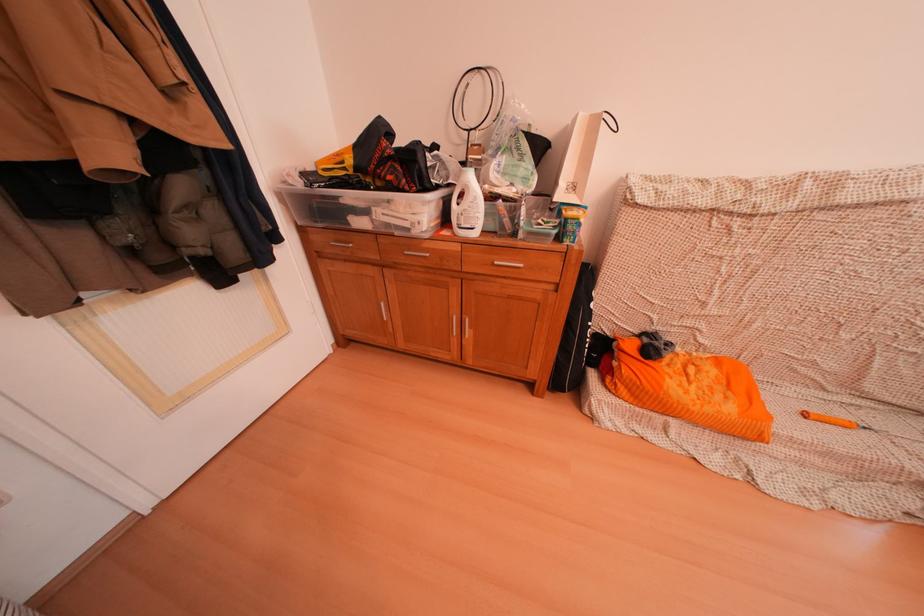
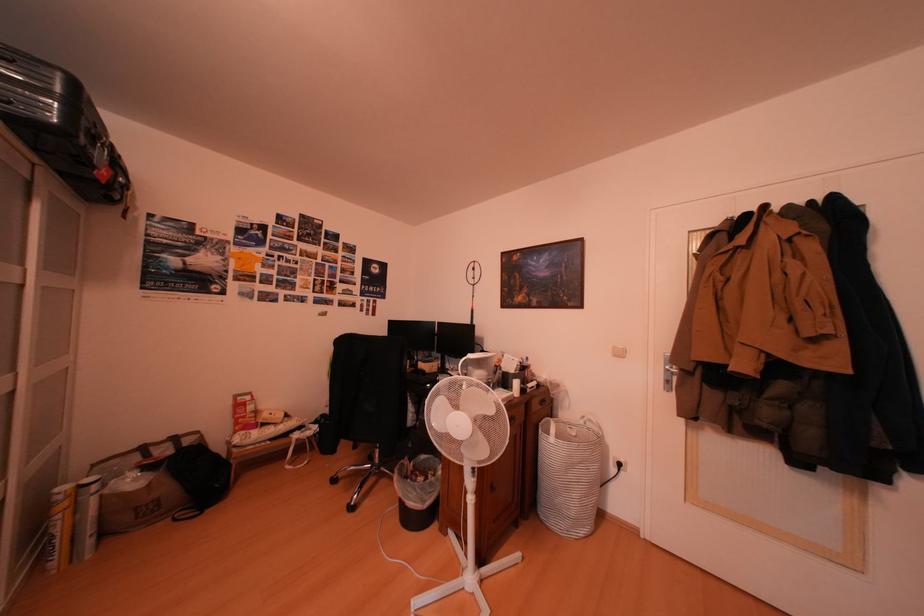
Question: How did the camera likely rotate?

Choices:
 (A) Left
 (B) Right
 (C) Up
 (D) Down

Answer: (A)